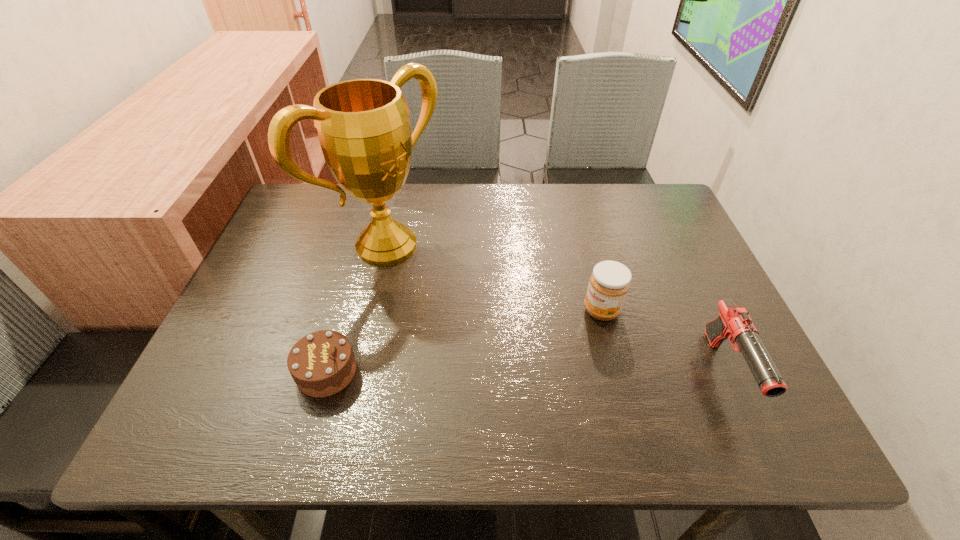
The image size is (960, 540). I want to click on vacant space that's between the jam and the tallest object, so click(x=494, y=278).

You are a GUI agent. You are given a task and a screenshot of the screen. Output one action in this format:
    pyautogui.click(x=<x>, y=<y>)
    Task: Click on the vacant region between the chocolate cake and the rightmost object
    This screenshot has height=540, width=960.
    Given the screenshot: What is the action you would take?
    pyautogui.click(x=526, y=372)

Identify the location of free space between the farthest object and the jam. This screenshot has width=960, height=540. (494, 278).

The height and width of the screenshot is (540, 960). Find the location of `free space between the tallest object and the gun`. free space between the tallest object and the gun is located at coordinates (557, 308).

You are a GUI agent. You are given a task and a screenshot of the screen. Output one action in this format:
    pyautogui.click(x=<x>, y=<y>)
    Task: Click on the empty location between the second object from right to left and the chocolate cake
    The width and height of the screenshot is (960, 540).
    Given the screenshot: What is the action you would take?
    pyautogui.click(x=465, y=341)

Identify which object is located as the nearest to the shortest object. Please provide its 2D coordinates. Your answer should be formatted as a tuple, i.e. [(x, y)], where the tuple contains the x and y coordinates of a point satisfying the conditions above.

[(363, 126)]

Choose which object is the third nearest neighbor to the chocolate cake. Please provide its 2D coordinates. Your answer should be formatted as a tuple, i.e. [(x, y)], where the tuple contains the x and y coordinates of a point satisfying the conditions above.

[(734, 323)]